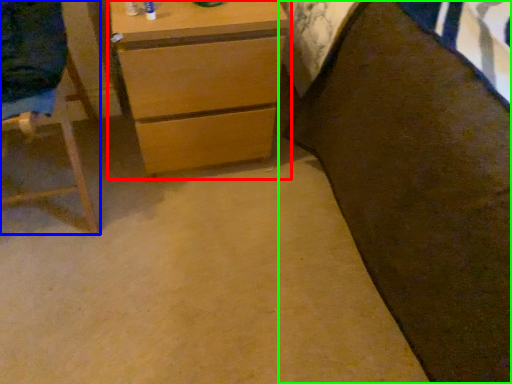
Question: Which object is positioned farthest from chest of drawers (highlighted by a red box)? Select from furniture (highlighted by a blue box) and bed (highlighted by a green box).

Choices:
 (A) furniture
 (B) bed

Answer: (B)